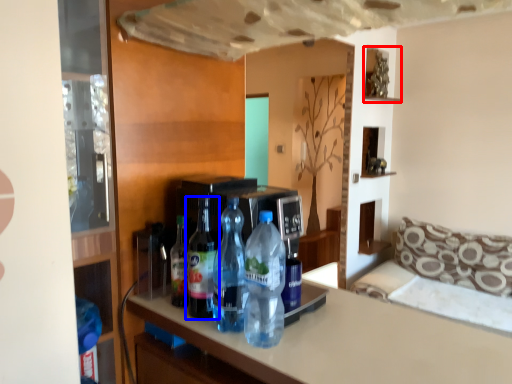
Question: Which object appears farthest to the camera in this image, shelf (highlighted by a red box) or bottle (highlighted by a blue box)?

Choices:
 (A) shelf
 (B) bottle

Answer: (A)